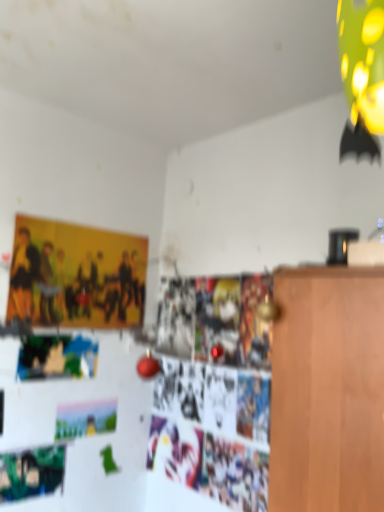
What do you see at coordinates (76, 276) in the screenshot?
I see `matte yellow poster at upper left` at bounding box center [76, 276].

At what (x,y) coordinates should I click in order to perform the action: click on green matte poster at lower left. Please return your answer as a coordinate pair (x, y). Image resolution: width=384 pixels, height=512 pixels. Looking at the image, I should click on (31, 473).

Identify the location of matte yellow poster at upper left. This screenshot has width=384, height=512. (76, 276).

Does green matte poster at lower left have a larger size compared to matte yellow poster at upper left?

Answer: Incorrect, green matte poster at lower left is not larger than matte yellow poster at upper left.

Would you say green matte poster at lower left is to the left or to the right of matte yellow poster at upper left in the picture?

green matte poster at lower left is to the left of matte yellow poster at upper left.

Is green matte poster at lower left not near matte yellow poster at upper left?

No, there isn't a large distance between green matte poster at lower left and matte yellow poster at upper left.

Is green matte poster at lower left situated inside matte yellow poster at upper left or outside?

green matte poster at lower left is spatially situated outside matte yellow poster at upper left.

Considering the sizes of objects pastel matte postcard at lower left and green matte poster at lower left in the image provided, who is smaller, pastel matte postcard at lower left or green matte poster at lower left?

pastel matte postcard at lower left.

From the image's perspective, does pastel matte postcard at lower left appear higher than green matte poster at lower left?

Indeed, from the image's perspective, pastel matte postcard at lower left is shown above green matte poster at lower left.

Does pastel matte postcard at lower left lie behind green matte poster at lower left?

Yes, pastel matte postcard at lower left is further from the viewer.

Which is closer, [62,426] or [17,497]?

Point [62,426] appears to be farther away from the viewer than point [17,497].

Is pastel matte postcard at lower left in front of or behind matte yellow poster at upper left in the image?

pastel matte postcard at lower left is positioned farther from the viewer than matte yellow poster at upper left.

At what (x,y) coordinates should I click in order to perform the action: click on person in front of the pastel matte postcard at lower left. Please return your answer as a coordinate pair (x, y). The width and height of the screenshot is (384, 512). Looking at the image, I should click on (76, 276).

Measure the distance between pastel matte postcard at lower left and matte yellow poster at upper left.

The distance of pastel matte postcard at lower left from matte yellow poster at upper left is 59.87 centimeters.

Is green matte poster at lower left oriented towards pastel matte postcard at lower left?

No, green matte poster at lower left is not facing towards pastel matte postcard at lower left.

Is green matte poster at lower left in front of pastel matte postcard at lower left?

Yes.

From a real-world perspective, relative to pastel matte postcard at lower left, is green matte poster at lower left vertically above or below?

green matte poster at lower left is below pastel matte postcard at lower left.

Can you confirm if green matte poster at lower left is smaller than pastel matte postcard at lower left?

Actually, green matte poster at lower left might be larger than pastel matte postcard at lower left.

Is matte yellow poster at upper left touching green matte poster at lower left?

No.

From the picture: Can you confirm if matte yellow poster at upper left is taller than green matte poster at lower left?

Yes.

Who is smaller, matte yellow poster at upper left or green matte poster at lower left?

Smaller between the two is green matte poster at lower left.

Is matte yellow poster at upper left located outside pastel matte postcard at lower left?

Indeed, matte yellow poster at upper left is completely outside pastel matte postcard at lower left.

The height and width of the screenshot is (512, 384). I want to click on person in front of the pastel matte postcard at lower left, so click(x=76, y=276).

From the image's perspective, would you say matte yellow poster at upper left is positioned over pastel matte postcard at lower left?

Indeed, from the image's perspective, matte yellow poster at upper left is shown above pastel matte postcard at lower left.

From a real-world perspective, who is located lower, matte yellow poster at upper left or pastel matte postcard at lower left?

pastel matte postcard at lower left, from a real-world perspective.

What are the coordinates of `person behind the green matte poster at lower left` in the screenshot? It's located at (76, 276).

You are a GUI agent. You are given a task and a screenshot of the screen. Output one action in this format:
    pyautogui.click(x=<x>, y=<y>)
    Task: Click on the postcard on the right of green matte poster at lower left
    
    Given the screenshot: What is the action you would take?
    pyautogui.click(x=85, y=419)

Looking at the image, which one is located closer to green matte poster at lower left, matte yellow poster at upper left or pastel matte postcard at lower left?

pastel matte postcard at lower left lies closer to green matte poster at lower left than the other object.

Consider the image. From the image, which object appears to be farther from pastel matte postcard at lower left, green matte poster at lower left or matte yellow poster at upper left?

Among the two, matte yellow poster at upper left is located further to pastel matte postcard at lower left.

From the image, which object appears to be nearer to matte yellow poster at upper left, green matte poster at lower left or pastel matte postcard at lower left?

pastel matte postcard at lower left.

Estimate the real-world distances between objects in this image. Which object is closer to matte yellow poster at upper left, pastel matte postcard at lower left or green matte poster at lower left?

pastel matte postcard at lower left is closer to matte yellow poster at upper left.

Considering their positions, is matte yellow poster at upper left positioned further to pastel matte postcard at lower left than green matte poster at lower left?

matte yellow poster at upper left lies further to pastel matte postcard at lower left than the other object.

Estimate the real-world distances between objects in this image. Which object is closer to green matte poster at lower left, pastel matte postcard at lower left or matte yellow poster at upper left?

pastel matte postcard at lower left lies closer to green matte poster at lower left than the other object.

The width and height of the screenshot is (384, 512). In order to click on postcard between matte yellow poster at upper left and green matte poster at lower left in the up-down direction in this screenshot , I will do `click(85, 419)`.